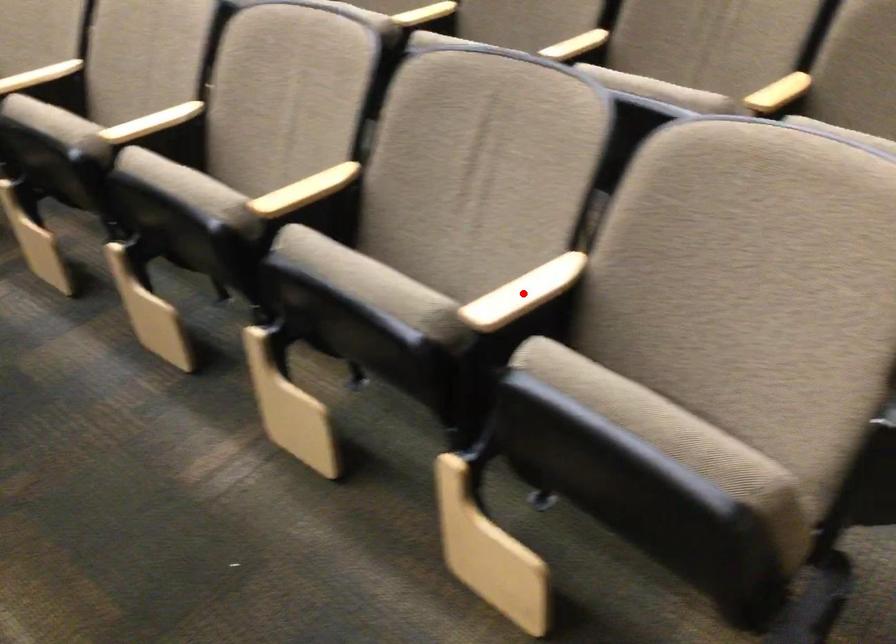
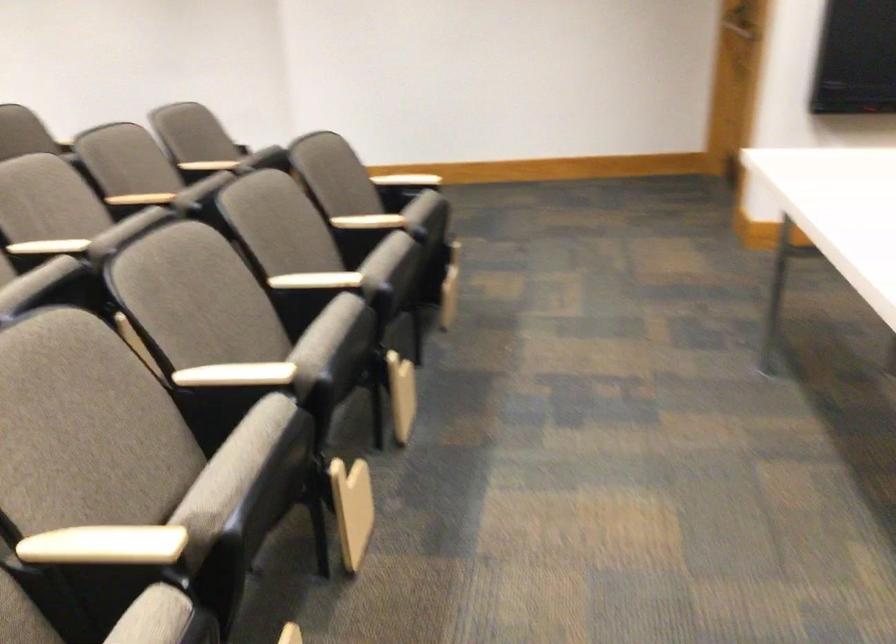
Question: I am providing you with two images of the same scene from different viewpoints. A red point is marked on the first image. Can you still see the location of the red point in image 2?

Choices:
 (A) Yes
 (B) No

Answer: (B)